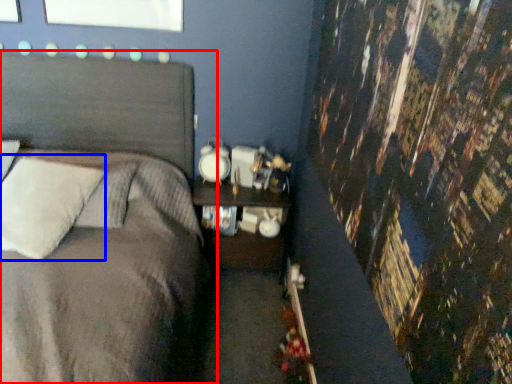
Question: Among these objects, which one is nearest to the camera, bed (highlighted by a red box) or pillow (highlighted by a blue box)?

Choices:
 (A) bed
 (B) pillow

Answer: (A)